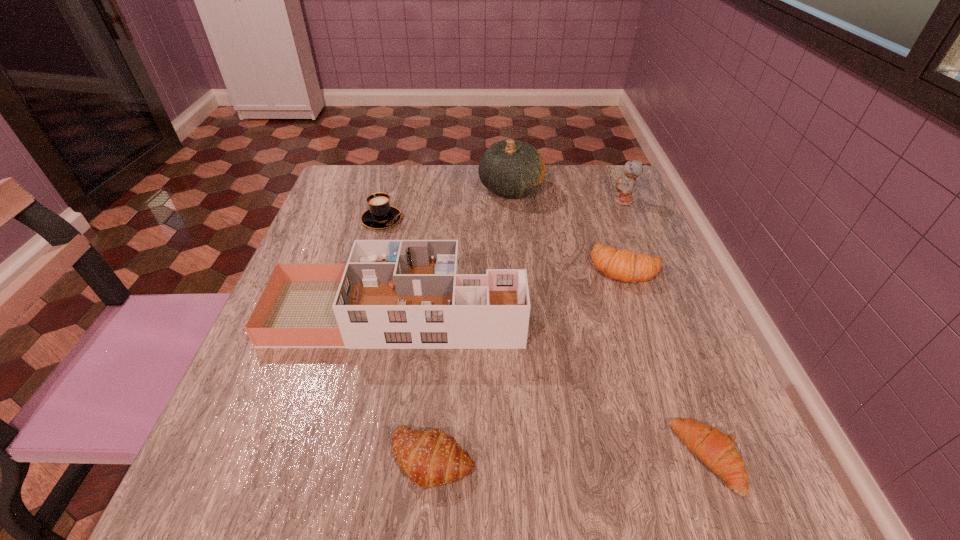
This screenshot has width=960, height=540. In order to click on blank space at the near left corner of the desktop in this screenshot , I will do `click(258, 499)`.

The height and width of the screenshot is (540, 960). I want to click on vacant space at the near right corner, so click(x=717, y=518).

The height and width of the screenshot is (540, 960). Identify the location of free point between the shortest crescent roll and the dollhouse. (552, 385).

Where is `unoccupied area between the second shortest crescent roll and the teddy bear`? The height and width of the screenshot is (540, 960). unoccupied area between the second shortest crescent roll and the teddy bear is located at coordinates (528, 330).

Image resolution: width=960 pixels, height=540 pixels. Find the location of `vacant space in between the shortest object and the leftmost crescent roll`. vacant space in between the shortest object and the leftmost crescent roll is located at coordinates (570, 458).

What are the coordinates of `free spot between the shortest crescent roll and the teddy bear` in the screenshot? It's located at (665, 329).

This screenshot has width=960, height=540. Identify the location of object that is the sixth closest one to the second shortest crescent roll. (625, 186).

Where is `object that is the third closest to the dollhouse`? Image resolution: width=960 pixels, height=540 pixels. object that is the third closest to the dollhouse is located at coordinates (380, 214).

I want to click on crescent roll that is the second closest to the shortest object, so click(x=623, y=265).

Identify which crescent roll is located as the nearest to the shortest crescent roll. Please provide its 2D coordinates. Your answer should be formatted as a tuple, i.e. [(x, y)], where the tuple contains the x and y coordinates of a point satisfying the conditions above.

[(431, 458)]